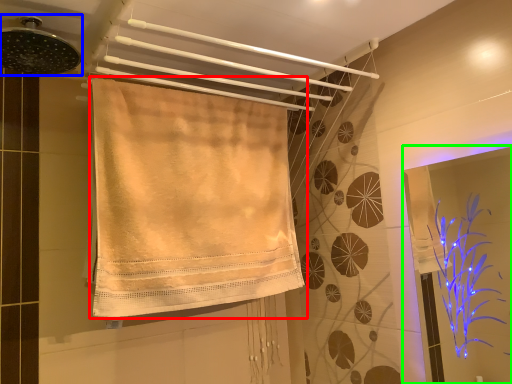
Question: Which object is positioned farthest from towel (highlighted by a red box)? Select from shower (highlighted by a blue box) and screen door (highlighted by a green box).

Choices:
 (A) shower
 (B) screen door

Answer: (B)